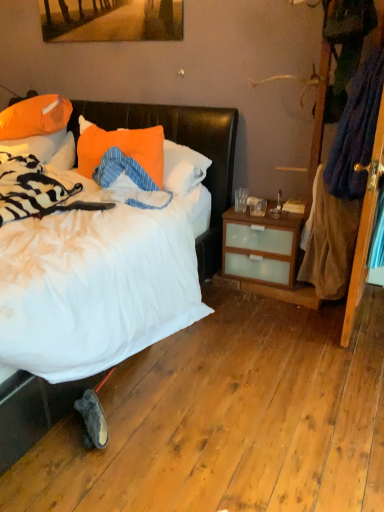
Question: From the image's perspective, is orange fabric pillow at center, marked as the third pillow in a left-to-right arrangement, on wooden screen door at right?

Choices:
 (A) no
 (B) yes

Answer: (B)

Question: Can you confirm if orange fabric pillow at center, the 1th pillow from the right, is taller than wooden screen door at right?

Choices:
 (A) yes
 (B) no

Answer: (B)

Question: Is orange fabric pillow at center, marked as the third pillow in a left-to-right arrangement, shorter than wooden screen door at right?

Choices:
 (A) no
 (B) yes

Answer: (B)

Question: Is wooden screen door at right inside orange fabric pillow at center, the 1th pillow from the right?

Choices:
 (A) yes
 (B) no

Answer: (B)

Question: Is orange fabric pillow at center, marked as the third pillow in a left-to-right arrangement, directly adjacent to wooden screen door at right?

Choices:
 (A) yes
 (B) no

Answer: (B)

Question: Considering the positions of orange fabric pillow at center, marked as the third pillow in a left-to-right arrangement, and white soft bed at left in the image, is orange fabric pillow at center, marked as the third pillow in a left-to-right arrangement, wider or thinner than white soft bed at left?

Choices:
 (A) thin
 (B) wide

Answer: (A)

Question: Considering their positions, is orange fabric pillow at center, marked as the third pillow in a left-to-right arrangement, located in front of or behind white soft bed at left?

Choices:
 (A) front
 (B) behind

Answer: (B)

Question: From their relative heights in the image, would you say orange fabric pillow at center, marked as the third pillow in a left-to-right arrangement, is taller or shorter than white soft bed at left?

Choices:
 (A) tall
 (B) short

Answer: (B)

Question: Is orange fabric pillow at center, the 1th pillow from the right, spatially inside white soft bed at left, or outside of it?

Choices:
 (A) outside
 (B) inside

Answer: (B)

Question: Considering their positions, is orange fabric pillow at upper left, the 3th pillow in the right-to-left sequence, located in front of or behind orange fabric pillow at center, marked as the third pillow in a left-to-right arrangement?

Choices:
 (A) front
 (B) behind

Answer: (B)

Question: From a real-world perspective, relative to orange fabric pillow at center, marked as the third pillow in a left-to-right arrangement, is orange fabric pillow at upper left, the first pillow positioned from the left, vertically above or below?

Choices:
 (A) below
 (B) above

Answer: (A)

Question: Looking at their shapes, would you say orange fabric pillow at upper left, the first pillow positioned from the left, is wider or thinner than orange fabric pillow at center, marked as the third pillow in a left-to-right arrangement?

Choices:
 (A) wide
 (B) thin

Answer: (A)

Question: Would you say orange fabric pillow at upper left, the first pillow positioned from the left, is to the left or to the right of orange fabric pillow at center, marked as the third pillow in a left-to-right arrangement, in the picture?

Choices:
 (A) right
 (B) left

Answer: (B)

Question: From a real-world perspective, is matte wooden picture frame at upper center above or below orange fabric pillow at center, the 1th pillow from the right?

Choices:
 (A) above
 (B) below

Answer: (A)

Question: Is matte wooden picture frame at upper center spatially inside orange fabric pillow at center, marked as the third pillow in a left-to-right arrangement, or outside of it?

Choices:
 (A) outside
 (B) inside

Answer: (A)